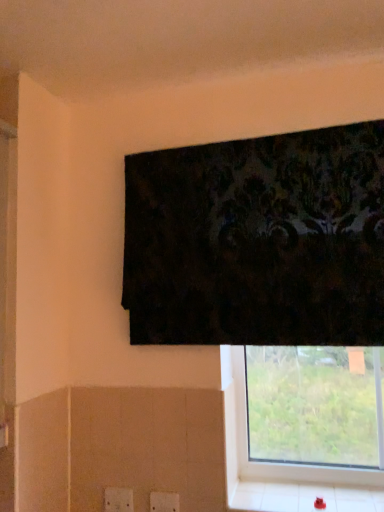
You are a GUI agent. You are given a task and a screenshot of the screen. Output one action in this format:
    pyautogui.click(x=<x>, y=<y>)
    Task: Click on the transparent glass window at lower right
    The width and height of the screenshot is (384, 512).
    Given the screenshot: What is the action you would take?
    click(x=277, y=463)

What do you see at coordinates (277, 463) in the screenshot?
I see `transparent glass window at lower right` at bounding box center [277, 463].

Locate an element on the screen. The height and width of the screenshot is (512, 384). transparent glass window at lower right is located at coordinates tap(277, 463).